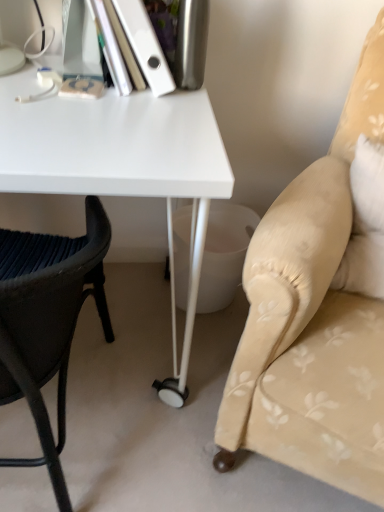
Question: Would you say black woven chair at left, which ranks as the first chair in left-to-right order, is inside or outside white glossy desk at center?

Choices:
 (A) inside
 (B) outside

Answer: (A)

Question: Is black woven chair at left, which ranks as the first chair in left-to-right order, wider or thinner than white glossy desk at center?

Choices:
 (A) thin
 (B) wide

Answer: (A)

Question: Estimate the real-world distances between objects in this image. Which object is closer to the beige fabric cushion at right, which ranks as the second chair in left-to-right order?

Choices:
 (A) white glossy desk at center
 (B) white matte book at upper left
 (C) black woven chair at left, which ranks as the first chair in left-to-right order

Answer: (A)

Question: Considering the real-world distances, which object is closest to the white matte book at upper left?

Choices:
 (A) beige fabric cushion at right, acting as the first chair starting from the right
 (B) black woven chair at left, marked as the second chair in a right-to-left arrangement
 (C) white glossy desk at center

Answer: (C)